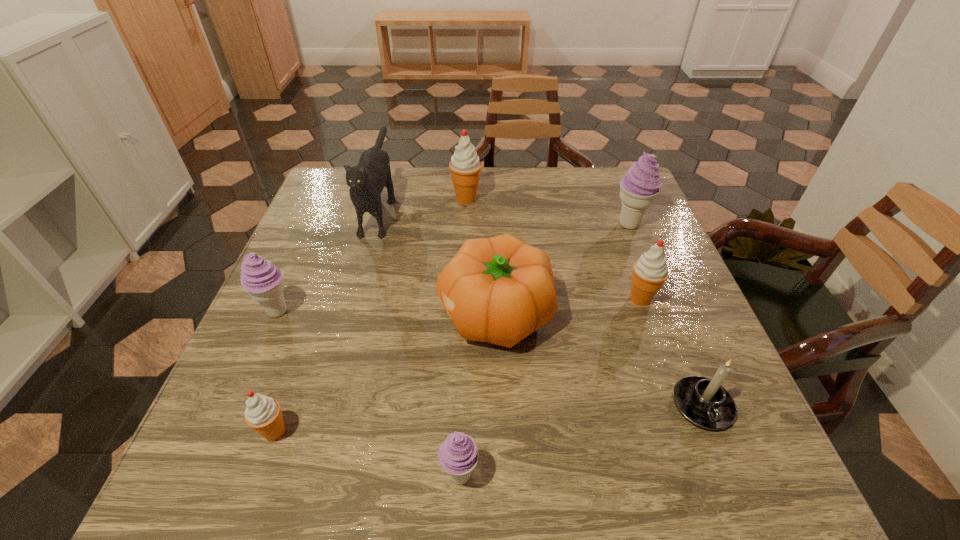
Where is `object located in the far left corner section of the desktop`? object located in the far left corner section of the desktop is located at coordinates (366, 180).

Where is `object that is at the near left corner`? object that is at the near left corner is located at coordinates (263, 414).

The image size is (960, 540). In order to click on blank space at the far edge of the desktop in this screenshot , I will do `click(502, 192)`.

Identify the location of vacant space at the near edge of the desktop. Image resolution: width=960 pixels, height=540 pixels. (560, 446).

The height and width of the screenshot is (540, 960). I want to click on vacant space at the left edge, so click(x=310, y=319).

Identify the location of free space at the right edge of the desktop. (612, 230).

In the image, there is a desktop. What are the coordinates of `vacant space at the far left corner` in the screenshot? It's located at (322, 189).

What are the coordinates of `vacant area at the far right corner` in the screenshot? It's located at (599, 196).

Where is `free space at the near right corner of the desktop`? free space at the near right corner of the desktop is located at coordinates (732, 457).

Find the location of `vacant area that lies between the pumpkin and the candle holder`. vacant area that lies between the pumpkin and the candle holder is located at coordinates (598, 360).